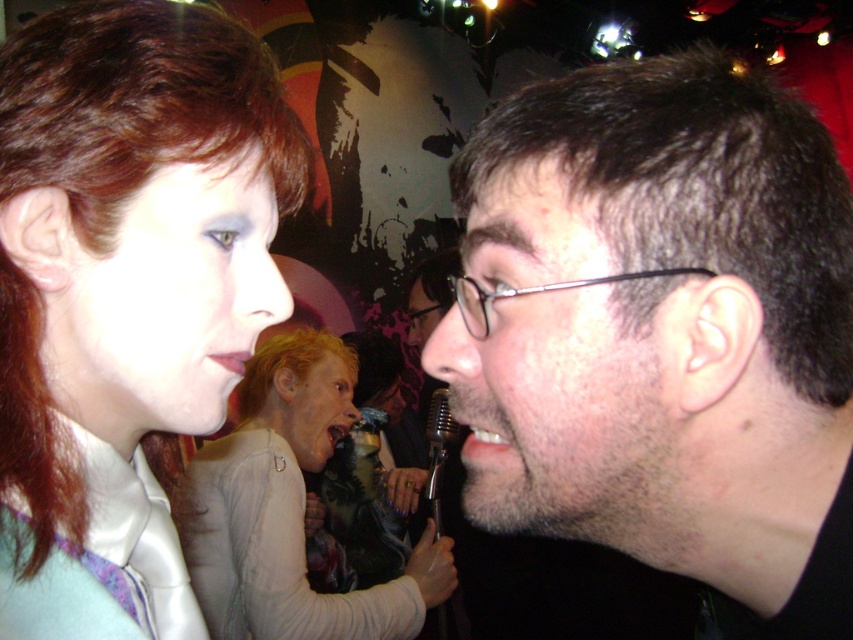
Is dark brown hair at center to the left of metallic silver microphone at center from the viewer's perspective?

Incorrect, dark brown hair at center is not on the left side of metallic silver microphone at center.

Is the position of dark brown hair at center less distant than that of metallic silver microphone at center?

Yes, dark brown hair at center is in front of metallic silver microphone at center.

Which is in front, point (550, 480) or point (436, 532)?

Positioned in front is point (550, 480).

Image resolution: width=853 pixels, height=640 pixels. I want to click on dark brown hair at center, so click(662, 332).

Which is more to the left, light beige sweater at center or metallic silver microphone at center?

light beige sweater at center

Is point (206, 580) positioned behind point (432, 406)?

No, (206, 580) is in front of (432, 406).

Locate an element on the screen. The image size is (853, 640). light beige sweater at center is located at coordinates [289, 509].

Is point (178, 134) behind point (244, 628)?

No, (178, 134) is closer to viewer.

Does satin white shirt at upper left appear over light beige sweater at center?

Yes.

The height and width of the screenshot is (640, 853). What are the coordinates of `satin white shirt at upper left` in the screenshot? It's located at (120, 276).